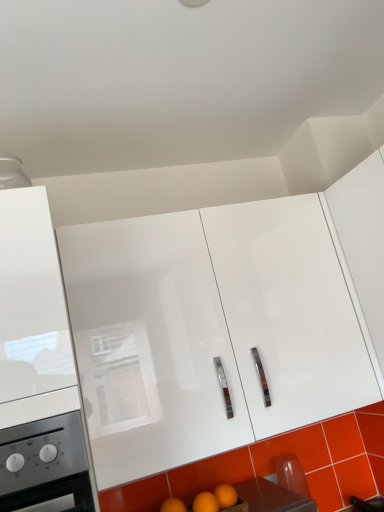
Question: Is white glossy cabinet at center, which is the second cabinetry in left-to-right order, positioned before white glossy cabinet at left, the 1th cabinetry positioned from the left?

Choices:
 (A) yes
 (B) no

Answer: (B)

Question: From a real-world perspective, is white glossy cabinet at center, placed as the 2th cabinetry when sorted from right to left, positioned under white glossy cabinet at left, the 1th cabinetry positioned from the left, based on gravity?

Choices:
 (A) no
 (B) yes

Answer: (B)

Question: Is white glossy cabinet at center, placed as the 2th cabinetry when sorted from right to left, thinner than white glossy cabinet at left, the 1th cabinetry positioned from the left?

Choices:
 (A) yes
 (B) no

Answer: (A)

Question: Does white glossy cabinet at center, placed as the 2th cabinetry when sorted from right to left, have a smaller size compared to white glossy cabinet at left, the 3th cabinetry positioned from the right?

Choices:
 (A) no
 (B) yes

Answer: (A)

Question: Does white glossy cabinet at center, which is the second cabinetry in left-to-right order, appear on the left side of white glossy cabinet at left, the 1th cabinetry positioned from the left?

Choices:
 (A) no
 (B) yes

Answer: (A)

Question: Is orange glossy tile at lower right inside or outside of white glossy cabinet at center, which is the second cabinetry in left-to-right order?

Choices:
 (A) outside
 (B) inside

Answer: (A)

Question: Considering the positions of orange glossy tile at lower right and white glossy cabinet at center, placed as the 2th cabinetry when sorted from right to left, in the image, is orange glossy tile at lower right wider or thinner than white glossy cabinet at center, placed as the 2th cabinetry when sorted from right to left,?

Choices:
 (A) wide
 (B) thin

Answer: (B)

Question: Based on their sizes in the image, would you say orange glossy tile at lower right is bigger or smaller than white glossy cabinet at center, which is the second cabinetry in left-to-right order?

Choices:
 (A) big
 (B) small

Answer: (B)

Question: In the image, is orange glossy tile at lower right on the left side or the right side of white glossy cabinet at center, placed as the 2th cabinetry when sorted from right to left?

Choices:
 (A) right
 (B) left

Answer: (A)

Question: From a real-world perspective, relative to orange matte wood at lower center, is white glossy cabinet at upper right, the third cabinetry when ordered from left to right, vertically above or below?

Choices:
 (A) below
 (B) above

Answer: (B)

Question: From the image's perspective, is white glossy cabinet at upper right, the third cabinetry when ordered from left to right, above or below orange matte wood at lower center?

Choices:
 (A) below
 (B) above

Answer: (B)

Question: Based on their sizes in the image, would you say white glossy cabinet at upper right, the third cabinetry when ordered from left to right, is bigger or smaller than orange matte wood at lower center?

Choices:
 (A) small
 (B) big

Answer: (B)

Question: Would you say white glossy cabinet at upper right, acting as the 1th cabinetry starting from the right, is inside or outside orange matte wood at lower center?

Choices:
 (A) outside
 (B) inside

Answer: (A)

Question: Would you say white glossy cabinet at center, which is the second cabinetry in left-to-right order, is to the left or to the right of orange glossy tile at lower right in the picture?

Choices:
 (A) left
 (B) right

Answer: (A)

Question: In terms of size, does white glossy cabinet at center, which is the second cabinetry in left-to-right order, appear bigger or smaller than orange glossy tile at lower right?

Choices:
 (A) big
 (B) small

Answer: (A)